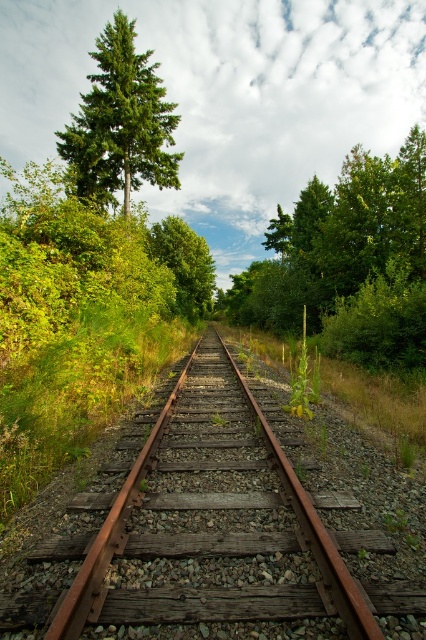
Question: Does rusty metal train track at center appear under green matte tree at upper left?

Choices:
 (A) yes
 (B) no

Answer: (A)

Question: Which point is farther to the camera?

Choices:
 (A) rusty metal train track at center
 (B) green leafy tree at center
 (C) green matte tree at upper left

Answer: (B)

Question: Considering the real-world distances, which object is closest to the rusty metal train track at center?

Choices:
 (A) green matte tree at upper left
 (B) green leafy tree at center

Answer: (A)

Question: Can you confirm if rusty metal train track at center is positioned below green matte tree at upper left?

Choices:
 (A) yes
 (B) no

Answer: (A)

Question: Among these points, which one is farthest from the camera?

Choices:
 (A) 195,237
 (B) 149,172

Answer: (A)

Question: Can you confirm if rusty metal train track at center is thinner than green matte tree at upper left?

Choices:
 (A) yes
 (B) no

Answer: (A)